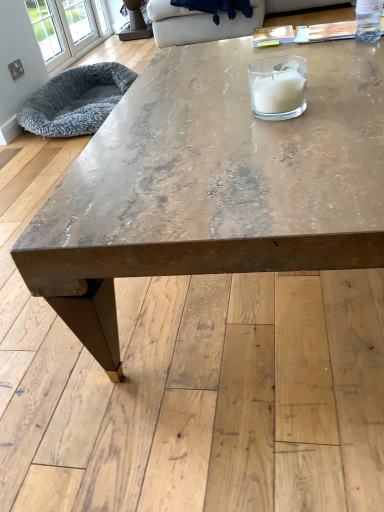
The image size is (384, 512). Identify the location of vacant area in front of clear glass bottle at upper right. (362, 51).